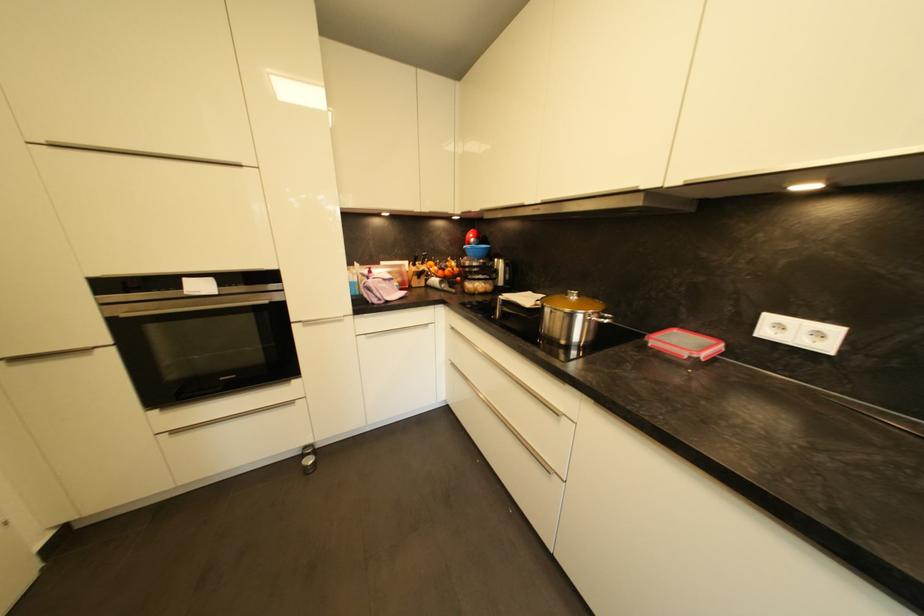
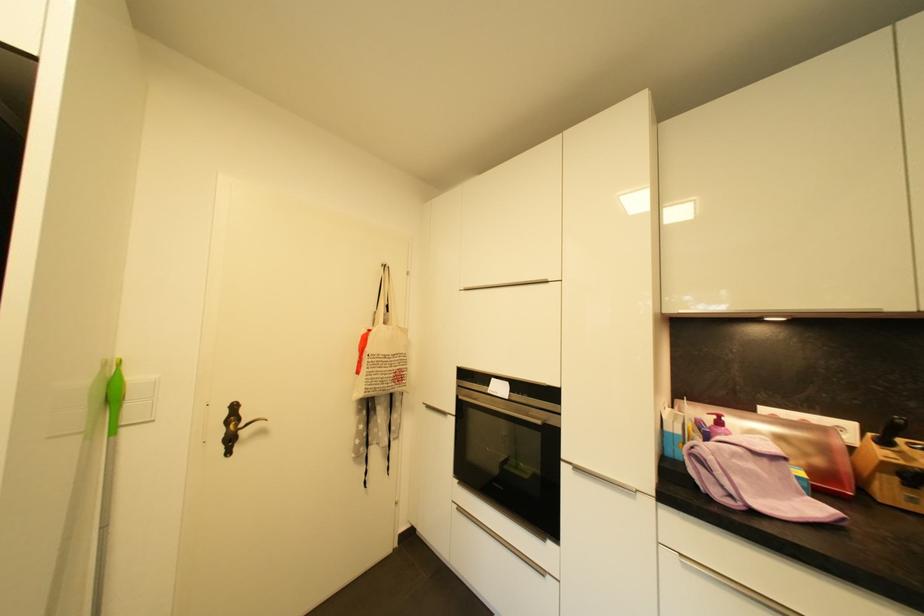
In the second image, find the point that corresponds to the point at 128,317 in the first image.

(466, 399)